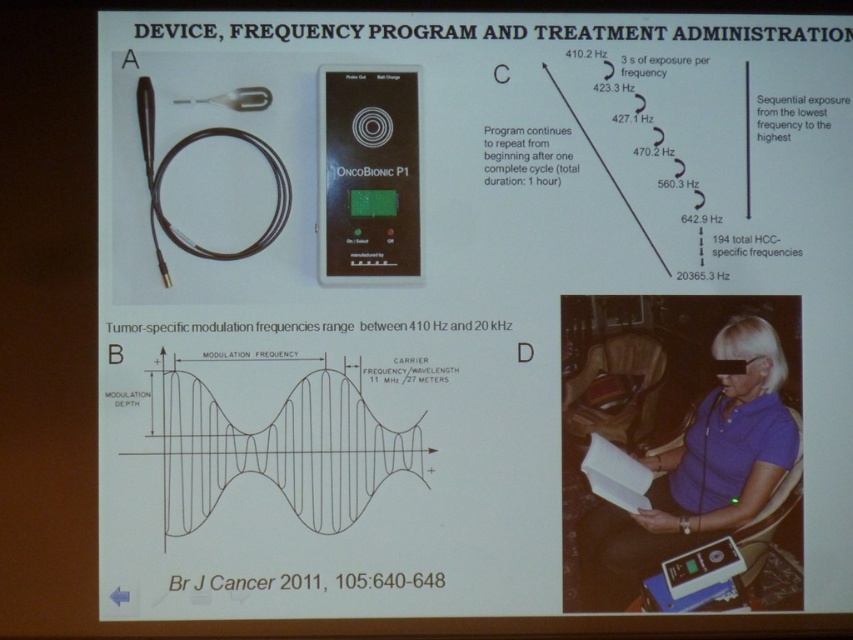
Which is more to the right, purple fabric shirt at center or black plastic oncobionic p1 at center?

purple fabric shirt at center is more to the right.

How much distance is there between purple fabric shirt at center and black plastic oncobionic p1 at center?

14.94 inches

Describe the element at coordinates (701, 467) in the screenshot. I see `purple fabric shirt at center` at that location.

Identify the location of purple fabric shirt at center. The height and width of the screenshot is (640, 853). (701, 467).